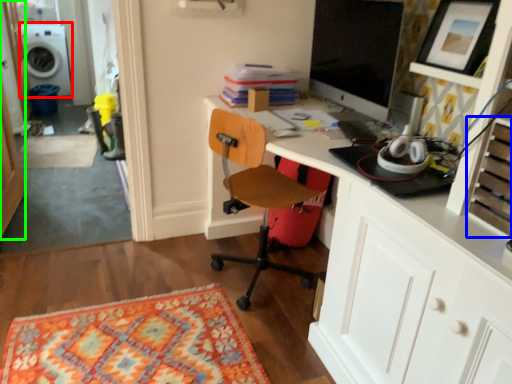
Question: Which object is positioned closest to washing machine (highlighted by a red box)? Select from drawer (highlighted by a blue box) and glass door (highlighted by a green box).

Choices:
 (A) drawer
 (B) glass door

Answer: (B)